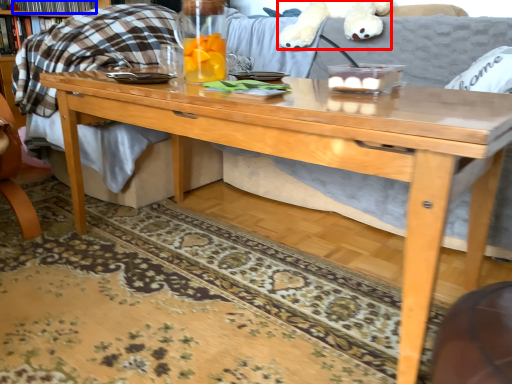
Question: Which point is further to the camera, animal (highlighted by a red box) or book (highlighted by a blue box)?

Choices:
 (A) animal
 (B) book

Answer: (B)